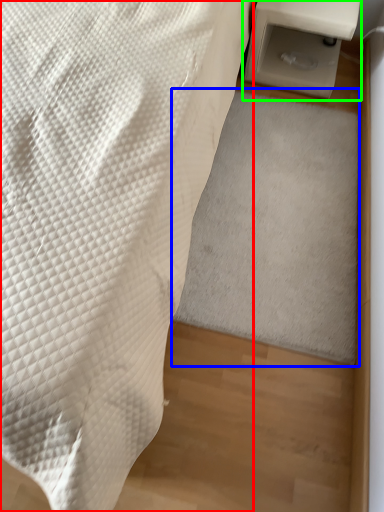
Question: Estimate the real-world distances between objects in this image. Which object is farther from furniture (highlighted by a red box), mat (highlighted by a blue box) or table (highlighted by a green box)?

Choices:
 (A) mat
 (B) table

Answer: (B)